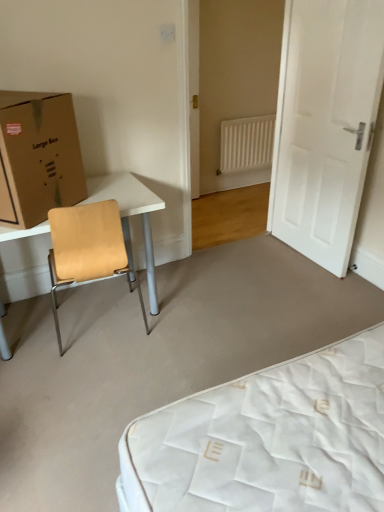
What are the coordinates of `free region under white matte door at right (from a real-world perspective)` in the screenshot? It's located at (297, 254).